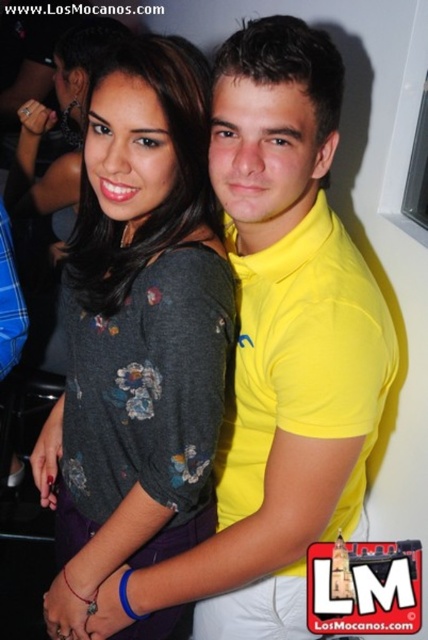
Is point (294, 515) less distant than point (184, 324)?

No, (294, 515) is behind (184, 324).

Is yellow cotton polo shirt at center bigger than dark gray floral shirt at center?

Correct, yellow cotton polo shirt at center is larger in size than dark gray floral shirt at center.

Who is more forward, (x=293, y=356) or (x=155, y=408)?

Positioned in front is point (x=293, y=356).

Where is `yellow cotton polo shirt at center`? This screenshot has width=428, height=640. yellow cotton polo shirt at center is located at coordinates (279, 349).